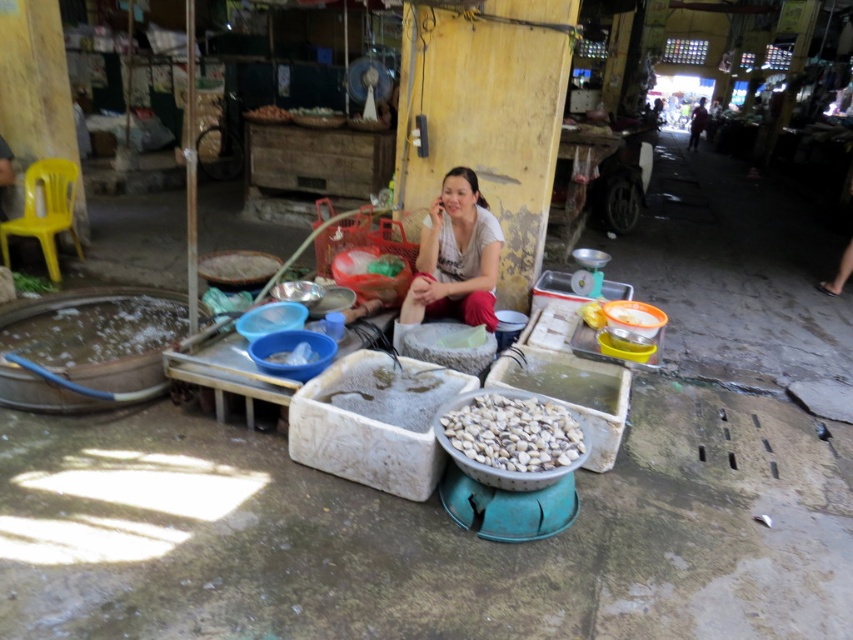
Question: Which point appears closest to the camera in this image?

Choices:
 (A) (498, 412)
 (B) (422, 227)

Answer: (A)

Question: Is white cotton shirt at center in front of white matte bowl at center?

Choices:
 (A) no
 (B) yes

Answer: (A)

Question: Can you confirm if white cotton shirt at center is bigger than white matte bowl at center?

Choices:
 (A) no
 (B) yes

Answer: (B)

Question: Among these points, which one is farthest from the camera?

Choices:
 (A) (445, 422)
 (B) (488, 228)

Answer: (B)

Question: Is white cotton shirt at center thinner than white matte bowl at center?

Choices:
 (A) yes
 (B) no

Answer: (B)